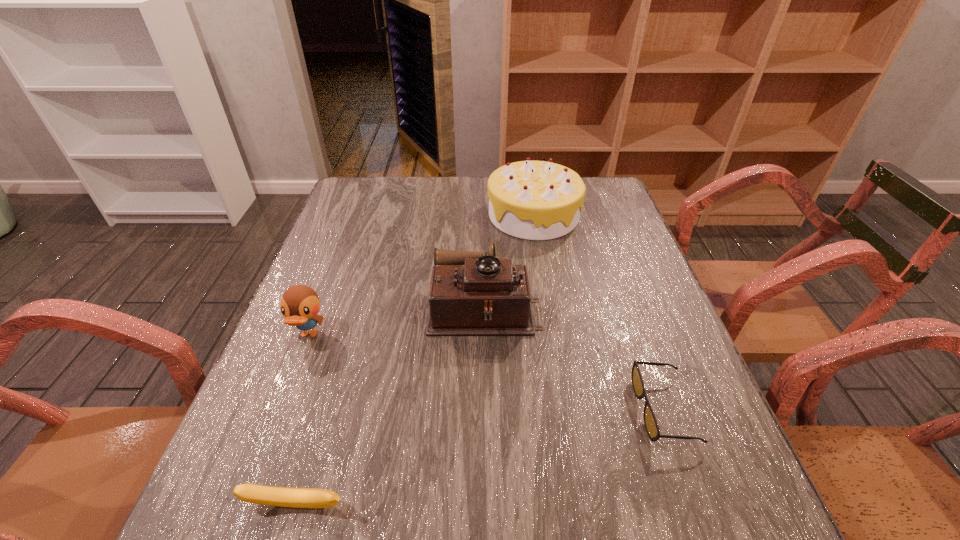
Identify the location of free space between the duck and the second nearest object. (487, 373).

The height and width of the screenshot is (540, 960). What are the coordinates of `empty space that is in between the duck and the birthday cake` in the screenshot? It's located at (421, 275).

Find the location of `free space that is in between the shortest object and the birthday cake`. free space that is in between the shortest object and the birthday cake is located at coordinates (599, 313).

The image size is (960, 540). What are the coordinates of `vacant region between the duck and the fourth farthest object` in the screenshot? It's located at (487, 373).

What are the coordinates of `empty space that is in between the duck and the farthest object` in the screenshot? It's located at (421, 275).

In order to click on blank region between the phonograph_record and the duck in this screenshot , I will do `click(396, 320)`.

The width and height of the screenshot is (960, 540). I want to click on object that is the third nearest to the birthday cake, so click(x=300, y=304).

Identify which object is the third nearest to the farthest object. Please provide its 2D coordinates. Your answer should be formatted as a tuple, i.e. [(x, y)], where the tuple contains the x and y coordinates of a point satisfying the conditions above.

[(300, 304)]

Locate an element on the screen. The image size is (960, 540). vacant space that satisfies the following two spatial constraints: 1. on the front-facing side of the second nearest object; 2. at the stem of the nearest object is located at coordinates (697, 505).

Find the location of a particular element. vacant area that satisfies the following two spatial constraints: 1. on the horn of the phonograph_record; 2. at the stem of the banana is located at coordinates (487, 505).